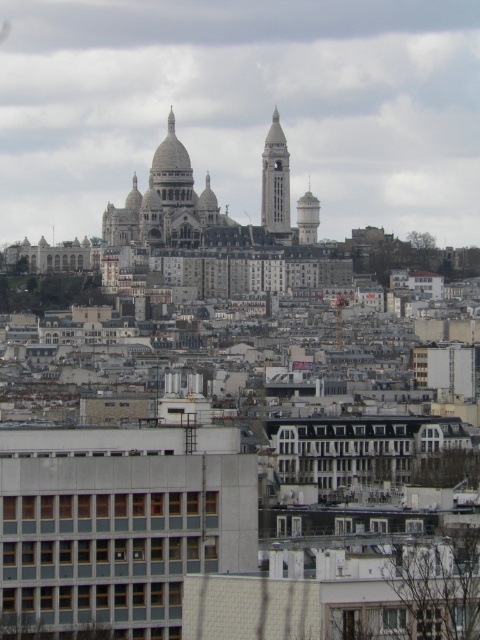
Is point (276, 202) positioned in front of point (310, 211)?

Yes, point (276, 202) is in front of point (310, 211).

Who is more forward, [278,225] or [314,209]?

Point [278,225]

Measure the distance between white stone clock tower at center and camera.

white stone clock tower at center is 636.65 meters from camera.

Find the location of a particular element. white stone clock tower at center is located at coordinates (276, 182).

This screenshot has width=480, height=640. What do you see at coordinates (165, 204) in the screenshot? I see `golden stone church at center` at bounding box center [165, 204].

Does golden stone church at center have a lesser height compared to white stone clock tower at center?

No.

At what (x,y) coordinates should I click in order to perform the action: click on golden stone church at center. Please return your answer as a coordinate pair (x, y). This screenshot has height=640, width=480. Looking at the image, I should click on (165, 204).

Who is lower down, golden stone church at center or light gray concrete tower at center right?

light gray concrete tower at center right

Is golden stone church at center positioned in front of light gray concrete tower at center right?

That is True.

Is point (147, 198) positioned before point (310, 196)?

Yes, it is.

I want to click on golden stone church at center, so click(165, 204).